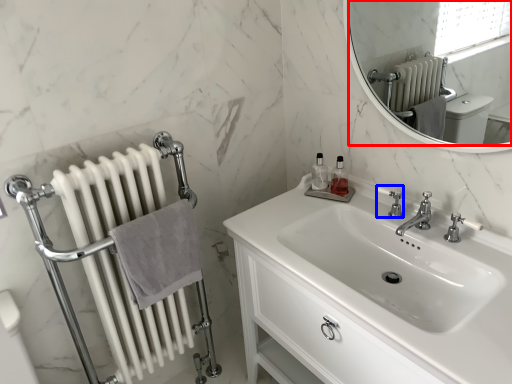
Question: Which point is further to the camera, mirror (highlighted by a red box) or plumbing fixture (highlighted by a blue box)?

Choices:
 (A) mirror
 (B) plumbing fixture

Answer: (B)